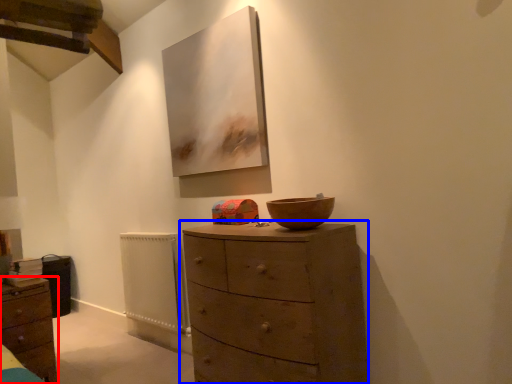
Question: Among these objects, which one is farthest to the camera, chest of drawers (highlighted by a red box) or chest of drawers (highlighted by a blue box)?

Choices:
 (A) chest of drawers
 (B) chest of drawers

Answer: (A)